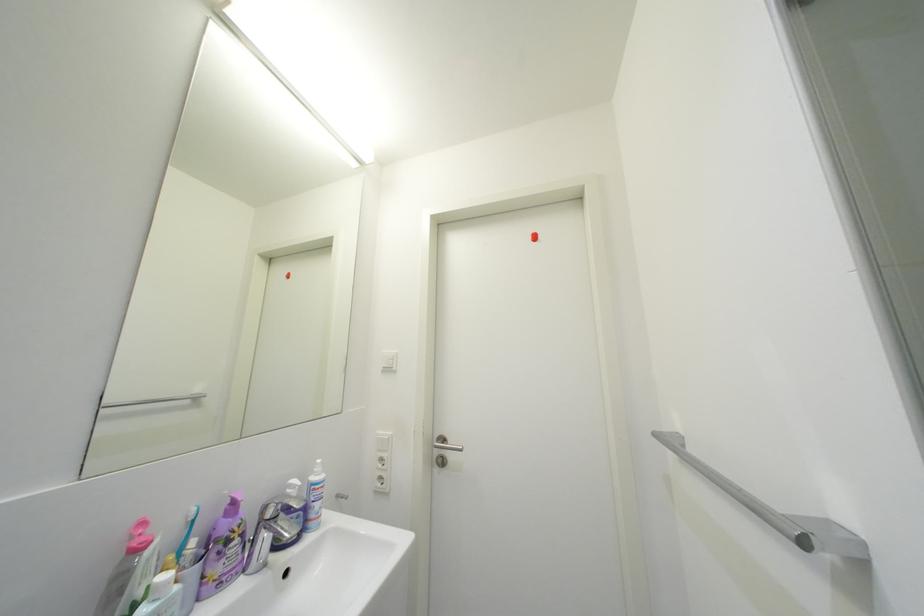
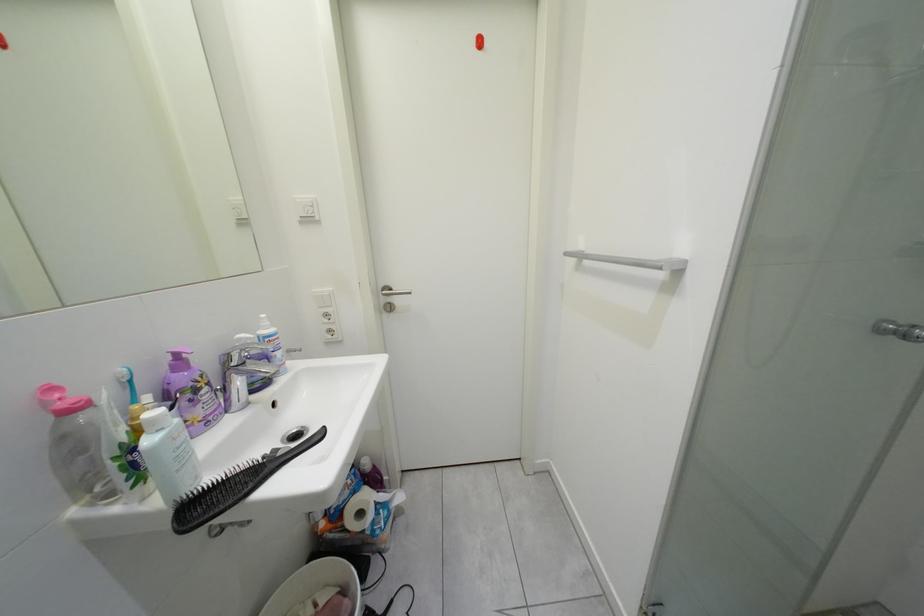
The first image is from the beginning of the video and the second image is from the end. How did the camera likely rotate when shooting the video?

The camera rotated toward right-down.